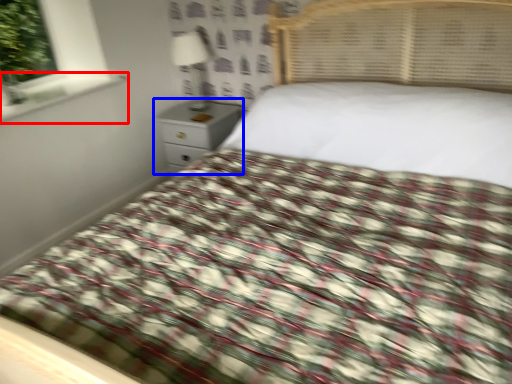
Question: Which object is closer to the camera taking this photo, window sill (highlighted by a red box) or nightstand (highlighted by a blue box)?

Choices:
 (A) window sill
 (B) nightstand

Answer: (A)